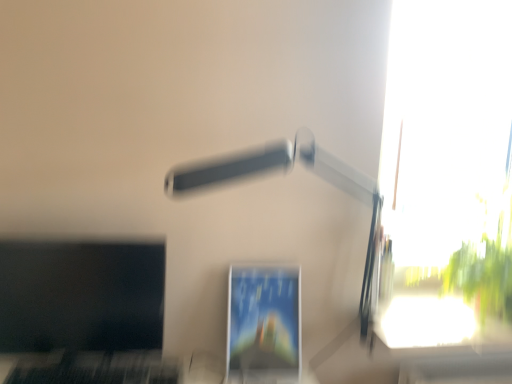
Question: Is transparent glass window at upper right taller or shorter than matte black monitor at left, the second computer monitor in the right-to-left sequence?

Choices:
 (A) short
 (B) tall

Answer: (B)

Question: Considering the positions of point pyautogui.click(x=458, y=61) and point pyautogui.click(x=105, y=311), is point pyautogui.click(x=458, y=61) closer or farther from the camera than point pyautogui.click(x=105, y=311)?

Choices:
 (A) closer
 (B) farther

Answer: (B)

Question: Estimate the real-world distances between objects in this image. Which object is farther from the black matte keyboard at lower left?

Choices:
 (A) transparent glass window at upper right
 (B) matte plastic monitor at center, the second computer monitor from the left
 (C) white plastic lamp at upper center
 (D) matte black monitor at left, arranged as the 1th computer monitor when viewed from the left

Answer: (A)

Question: Which object is positioned closest to the matte black monitor at left, arranged as the 1th computer monitor when viewed from the left?

Choices:
 (A) transparent glass window at upper right
 (B) white plastic lamp at upper center
 (C) matte plastic monitor at center, which is the first computer monitor from right to left
 (D) black matte keyboard at lower left

Answer: (D)